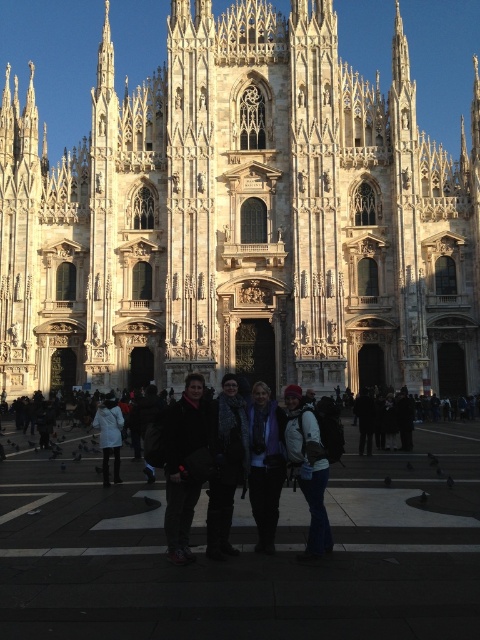
Question: Which point is farther to the camera?

Choices:
 (A) (253, 488)
 (B) (172, 460)

Answer: (A)

Question: Which of the following is the farthest from the observer?

Choices:
 (A) dark gray sweater at center
 (B) denim jacket at center
 (C) white stone church at center

Answer: (C)

Question: Is black fabric jacket at center closer to camera compared to denim jacket at center?

Choices:
 (A) no
 (B) yes

Answer: (B)

Question: Which object appears farthest from the camera in this image?

Choices:
 (A) black fabric jacket at center
 (B) white matte jacket at center
 (C) white stone church at center
 (D) dark blue jeans at center

Answer: (C)

Question: Is dark blue jeans at center smaller than denim jacket at center?

Choices:
 (A) no
 (B) yes

Answer: (B)

Question: Is dark gray sweater at center positioned in front of dark blue jeans at center?

Choices:
 (A) no
 (B) yes

Answer: (B)